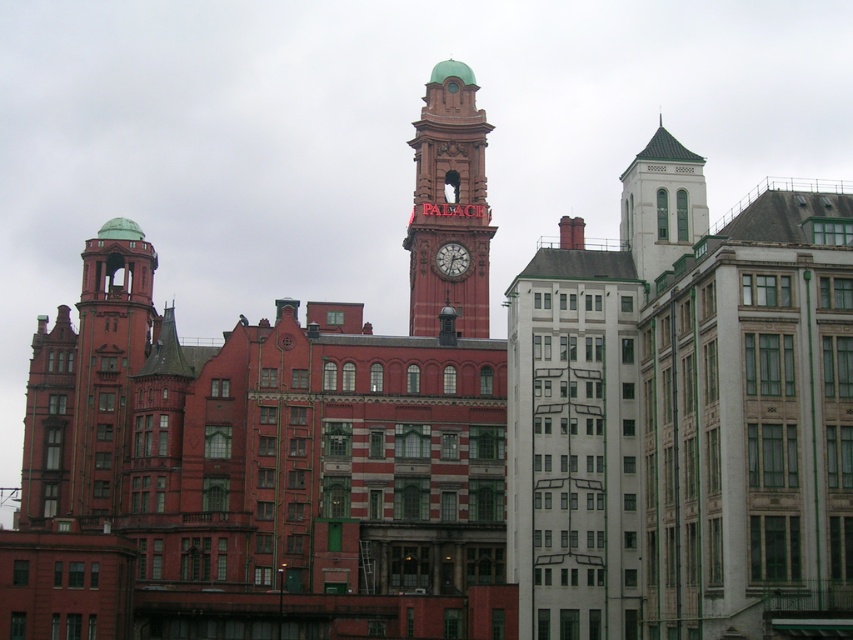
You are a tourist visiting the city and want to take a photo of the matte red clock tower at center and the matte red clock at center. Which one should you zoom in on to capture more details without moving closer?

The matte red clock tower at center is bigger than the matte red clock at center, so you should zoom in on the matte red clock tower at center to capture more details without moving closer.